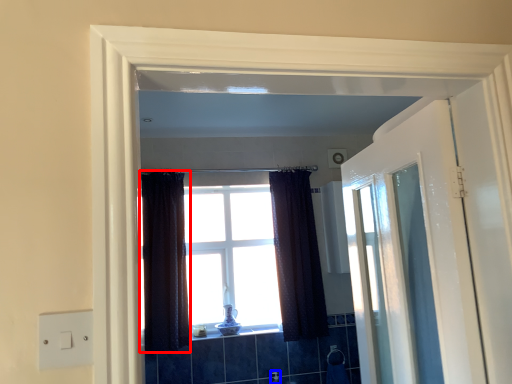
Question: Which object is further to the camera taking this photo, curtain (highlighted by a red box) or faucet (highlighted by a blue box)?

Choices:
 (A) curtain
 (B) faucet

Answer: (B)